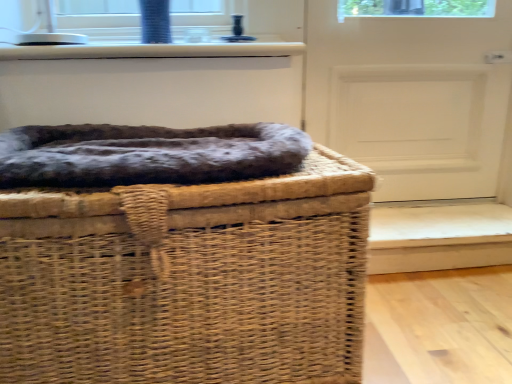
Question: Is dark gray plush dog bed at center completely or partially inside white glossy window sill at upper center?

Choices:
 (A) no
 (B) yes

Answer: (A)

Question: Considering the relative sizes of white glossy window sill at upper center and dark gray plush dog bed at center in the image provided, is white glossy window sill at upper center taller than dark gray plush dog bed at center?

Choices:
 (A) yes
 (B) no

Answer: (A)

Question: From a real-world perspective, is white glossy window sill at upper center on top of dark gray plush dog bed at center?

Choices:
 (A) no
 (B) yes

Answer: (B)

Question: Is white glossy window sill at upper center to the right of dark gray plush dog bed at center from the viewer's perspective?

Choices:
 (A) no
 (B) yes

Answer: (A)

Question: From the image's perspective, is white glossy window sill at upper center on dark gray plush dog bed at center?

Choices:
 (A) no
 (B) yes

Answer: (B)

Question: Is white glossy window sill at upper center further to camera compared to dark gray plush dog bed at center?

Choices:
 (A) no
 (B) yes

Answer: (B)

Question: Does dark gray plush dog bed at center have a larger size compared to woven brown basket at center?

Choices:
 (A) yes
 (B) no

Answer: (B)

Question: Is woven brown basket at center at the back of dark gray plush dog bed at center?

Choices:
 (A) yes
 (B) no

Answer: (B)

Question: From a real-world perspective, is dark gray plush dog bed at center located beneath woven brown basket at center?

Choices:
 (A) no
 (B) yes

Answer: (A)

Question: Would you say dark gray plush dog bed at center is outside woven brown basket at center?

Choices:
 (A) yes
 (B) no

Answer: (B)

Question: Does dark gray plush dog bed at center have a lesser height compared to woven brown basket at center?

Choices:
 (A) yes
 (B) no

Answer: (A)

Question: Does dark gray plush dog bed at center have a greater width compared to woven brown basket at center?

Choices:
 (A) yes
 (B) no

Answer: (B)

Question: Is woven brown basket at center positioned behind white glossy window sill at upper center?

Choices:
 (A) yes
 (B) no

Answer: (B)